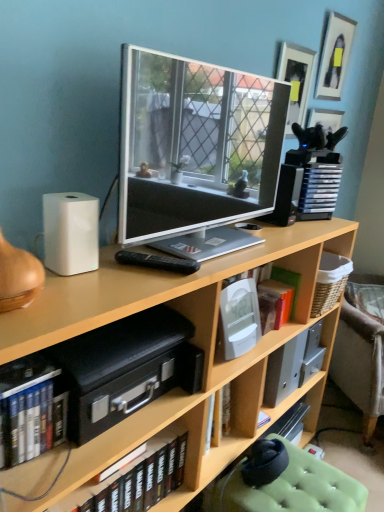
Locate an element on the screen. free space above light brown wood bookcase at center (from a real-world perspective) is located at coordinates (198, 269).